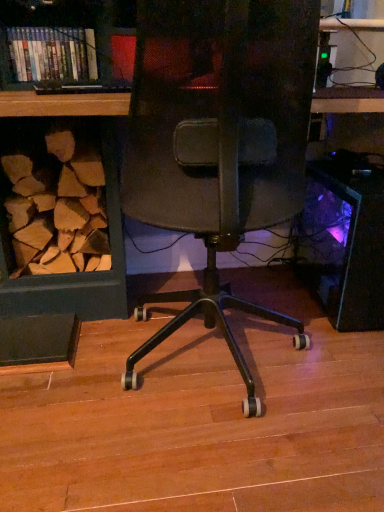
Question: Is black plastic desktop at right far away from hardcover books at upper left?

Choices:
 (A) yes
 (B) no

Answer: (A)

Question: Is black plastic desktop at right to the left of hardcover books at upper left from the viewer's perspective?

Choices:
 (A) yes
 (B) no

Answer: (B)

Question: Is black plastic desktop at right at the right side of hardcover books at upper left?

Choices:
 (A) yes
 (B) no

Answer: (A)

Question: From the image's perspective, is black plastic desktop at right on hardcover books at upper left?

Choices:
 (A) yes
 (B) no

Answer: (B)

Question: Is the position of black plastic desktop at right more distant than that of hardcover books at upper left?

Choices:
 (A) no
 (B) yes

Answer: (A)

Question: Considering the relative sizes of black plastic desktop at right and hardcover books at upper left in the image provided, is black plastic desktop at right bigger than hardcover books at upper left?

Choices:
 (A) no
 (B) yes

Answer: (B)

Question: From the image's perspective, is hardcover books at upper left on black plastic desktop at right?

Choices:
 (A) no
 (B) yes

Answer: (B)

Question: Is hardcover books at upper left positioned in front of black plastic desktop at right?

Choices:
 (A) no
 (B) yes

Answer: (A)

Question: Could black plastic desktop at right be considered to be inside hardcover books at upper left?

Choices:
 (A) no
 (B) yes

Answer: (A)

Question: Does hardcover books at upper left have a larger size compared to black plastic desktop at right?

Choices:
 (A) yes
 (B) no

Answer: (B)

Question: Is hardcover books at upper left smaller than black plastic desktop at right?

Choices:
 (A) no
 (B) yes

Answer: (B)

Question: From a real-world perspective, does hardcover books at upper left stand above black plastic desktop at right?

Choices:
 (A) no
 (B) yes

Answer: (B)

Question: Would you say hardcover books at upper left is to the left or to the right of black plastic desktop at right in the picture?

Choices:
 (A) right
 (B) left

Answer: (B)